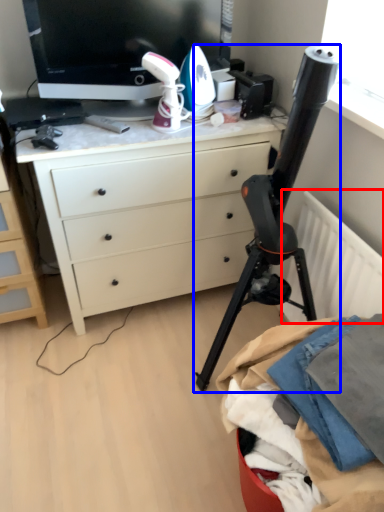
Question: Which object is closer to the camera taking this photo, radiator (highlighted by a red box) or tripod (highlighted by a blue box)?

Choices:
 (A) radiator
 (B) tripod

Answer: (B)